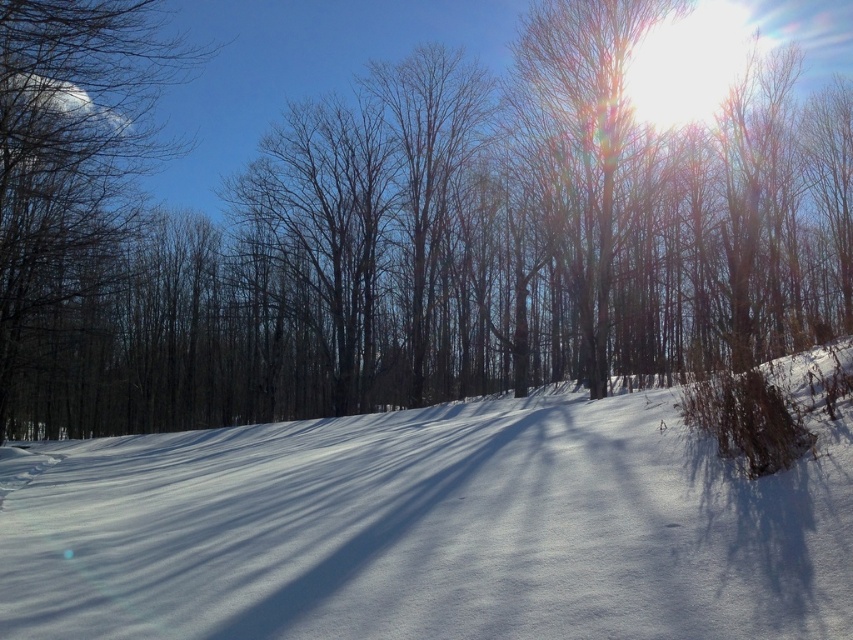
Is brown/dry wood at center above smooth bark tree at upper right?

No, brown/dry wood at center is not above smooth bark tree at upper right.

Which is more to the left, brown/dry wood at center or smooth bark tree at upper right?

brown/dry wood at center is more to the left.

The width and height of the screenshot is (853, 640). I want to click on brown/dry wood at center, so click(415, 230).

Between point (485, 557) and point (120, 29), which one is positioned behind?

Point (120, 29)

Is white snow at center behind brown bark tree at left?

No.

Locate an element on the screen. The image size is (853, 640). white snow at center is located at coordinates (428, 529).

Find the location of a particular element. white snow at center is located at coordinates [428, 529].

Is brown/dry wood at center smaller than brown bark tree at left?

Actually, brown/dry wood at center might be larger than brown bark tree at left.

Between brown/dry wood at center and brown bark tree at left, which one appears on the right side from the viewer's perspective?

brown/dry wood at center

Does point (309, 340) come in front of point (12, 221)?

No, it is not.

The height and width of the screenshot is (640, 853). I want to click on brown/dry wood at center, so click(x=415, y=230).